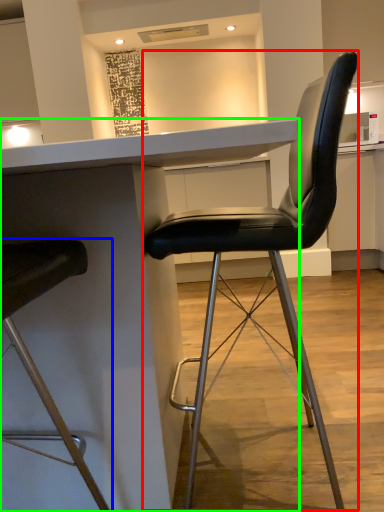
Question: Considering the real-world distances, which object is farthest from chair (highlighted by a red box)? chair (highlighted by a blue box) or table (highlighted by a green box)?

Choices:
 (A) chair
 (B) table

Answer: (A)